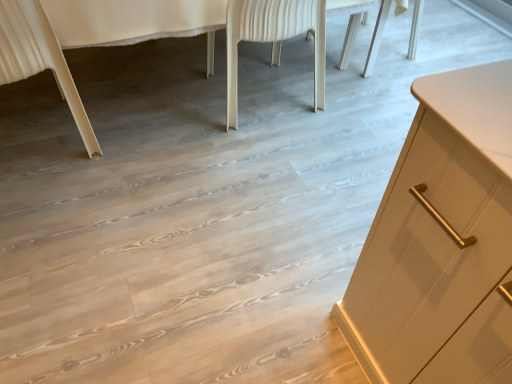
Find the location of a particular element. The image size is (512, 384). white wood chair at center, marked as the 1th chair in a right-to-left arrangement is located at coordinates (273, 39).

In order to face white glossy cabinet at right, should I rotate leftwards or rightwards?

To face it directly, rotate left by 8.576 degrees.

Where is `light beige wood chair leg at lower left, placed as the 1th chair when sorted from left to right`? light beige wood chair leg at lower left, placed as the 1th chair when sorted from left to right is located at coordinates (39, 58).

Measure the distance between white glossy cabinet at right and light beige wood chair leg at lower left, placed as the 1th chair when sorted from left to right.

A distance of 2.62 inches exists between white glossy cabinet at right and light beige wood chair leg at lower left, placed as the 1th chair when sorted from left to right.

Is white glossy cabinet at right positioned far away from light beige wood chair leg at lower left, placed as the 1th chair when sorted from left to right?

No.

Considering the relative sizes of white glossy cabinet at right and light beige wood chair leg at lower left, placed as the 1th chair when sorted from left to right, in the image provided, is white glossy cabinet at right smaller than light beige wood chair leg at lower left, placed as the 1th chair when sorted from left to right,?

Actually, white glossy cabinet at right might be larger than light beige wood chair leg at lower left, placed as the 1th chair when sorted from left to right.

Is white glossy cabinet at right positioned beyond the bounds of light beige wood chair leg at lower left, which is counted as the 2th chair, starting from the right?

white glossy cabinet at right lies outside light beige wood chair leg at lower left, which is counted as the 2th chair, starting from the right,'s area.

Can we say white wood chair at center, marked as the 1th chair in a right-to-left arrangement, lies outside light beige wood chair leg at lower left, placed as the 1th chair when sorted from left to right?

white wood chair at center, marked as the 1th chair in a right-to-left arrangement, is positioned outside light beige wood chair leg at lower left, placed as the 1th chair when sorted from left to right.

Does point (233, 84) appear closer or farther from the camera than point (26, 32)?

Point (233, 84) appears to be farther away from the viewer than point (26, 32).

Which object is wider, white wood chair at center, marked as the 1th chair in a right-to-left arrangement, or light beige wood chair leg at lower left, which is counted as the 2th chair, starting from the right?

white wood chair at center, marked as the 1th chair in a right-to-left arrangement.

From the image's perspective, does white wood chair at center, which appears as the second chair when viewed from the left, appear higher than light beige wood chair leg at lower left, which is counted as the 2th chair, starting from the right?

Yes, from the image's perspective, white wood chair at center, which appears as the second chair when viewed from the left, is over light beige wood chair leg at lower left, which is counted as the 2th chair, starting from the right.

Is white glossy cabinet at right facing towards white wood chair at center, marked as the 1th chair in a right-to-left arrangement?

Yes, white glossy cabinet at right is turned towards white wood chair at center, marked as the 1th chair in a right-to-left arrangement.

Is white glossy cabinet at right beside white wood chair at center, which appears as the second chair when viewed from the left?

No, white glossy cabinet at right is not with white wood chair at center, which appears as the second chair when viewed from the left.

Can you confirm if white glossy cabinet at right is bigger than white wood chair at center, which appears as the second chair when viewed from the left?

Correct, white glossy cabinet at right is larger in size than white wood chair at center, which appears as the second chair when viewed from the left.

Can you confirm if white glossy cabinet at right is thinner than white wood chair at center, which appears as the second chair when viewed from the left?

Incorrect, the width of white glossy cabinet at right is not less than that of white wood chair at center, which appears as the second chair when viewed from the left.

Is light beige wood chair leg at lower left, placed as the 1th chair when sorted from left to right, positioned far away from white glossy cabinet at right?

No, light beige wood chair leg at lower left, placed as the 1th chair when sorted from left to right, is not far from white glossy cabinet at right.

Looking at this image, from the image's perspective, between light beige wood chair leg at lower left, placed as the 1th chair when sorted from left to right, and white glossy cabinet at right, who is located below?

light beige wood chair leg at lower left, placed as the 1th chair when sorted from left to right.

Does light beige wood chair leg at lower left, which is counted as the 2th chair, starting from the right, have a lesser height compared to white glossy cabinet at right?

Correct, light beige wood chair leg at lower left, which is counted as the 2th chair, starting from the right, is not as tall as white glossy cabinet at right.

Can you tell me how much light beige wood chair leg at lower left, placed as the 1th chair when sorted from left to right, and white wood chair at center, marked as the 1th chair in a right-to-left arrangement, differ in facing direction?

They differ by 4.4 degrees in their facing directions.

Is light beige wood chair leg at lower left, placed as the 1th chair when sorted from left to right, surrounding white wood chair at center, which appears as the second chair when viewed from the left?

Actually, white wood chair at center, which appears as the second chair when viewed from the left, is outside light beige wood chair leg at lower left, placed as the 1th chair when sorted from left to right.

This screenshot has width=512, height=384. Find the location of `chair that appears in front of the white wood chair at center, marked as the 1th chair in a right-to-left arrangement`. chair that appears in front of the white wood chair at center, marked as the 1th chair in a right-to-left arrangement is located at coordinates (39, 58).

Considering the sizes of white wood chair at center, which appears as the second chair when viewed from the left, and white glossy cabinet at right in the image, is white wood chair at center, which appears as the second chair when viewed from the left, wider or thinner than white glossy cabinet at right?

white wood chair at center, which appears as the second chair when viewed from the left, is thinner than white glossy cabinet at right.

Is white wood chair at center, which appears as the second chair when viewed from the left, not near white glossy cabinet at right?

No, there isn't a large distance between white wood chair at center, which appears as the second chair when viewed from the left, and white glossy cabinet at right.

From the image's perspective, is white wood chair at center, which appears as the second chair when viewed from the left, below white glossy cabinet at right?

Indeed, from the image's perspective, white wood chair at center, which appears as the second chair when viewed from the left, is shown beneath white glossy cabinet at right.

How different are the orientations of white wood chair at center, marked as the 1th chair in a right-to-left arrangement, and white glossy cabinet at right in degrees?

They differ by 178 degrees in their facing directions.

Find the location of a particular element. The height and width of the screenshot is (384, 512). chair on the left of white glossy cabinet at right is located at coordinates (39, 58).

The width and height of the screenshot is (512, 384). I want to click on chair lying above the light beige wood chair leg at lower left, placed as the 1th chair when sorted from left to right (from the image's perspective), so click(273, 39).

Estimate the real-world distances between objects in this image. Which object is further from white wood chair at center, which appears as the second chair when viewed from the left, white glossy cabinet at right or light beige wood chair leg at lower left, which is counted as the 2th chair, starting from the right?

light beige wood chair leg at lower left, which is counted as the 2th chair, starting from the right, lies further to white wood chair at center, which appears as the second chair when viewed from the left, than the other object.

When comparing their distances from light beige wood chair leg at lower left, placed as the 1th chair when sorted from left to right, does white glossy cabinet at right or white wood chair at center, marked as the 1th chair in a right-to-left arrangement, seem further?

Based on the image, white wood chair at center, marked as the 1th chair in a right-to-left arrangement, appears to be further to light beige wood chair leg at lower left, placed as the 1th chair when sorted from left to right.

Which object lies nearer to the anchor point white glossy cabinet at right, light beige wood chair leg at lower left, which is counted as the 2th chair, starting from the right, or white wood chair at center, which appears as the second chair when viewed from the left?

light beige wood chair leg at lower left, which is counted as the 2th chair, starting from the right, lies closer to white glossy cabinet at right than the other object.

Estimate the real-world distances between objects in this image. Which object is closer to light beige wood chair leg at lower left, which is counted as the 2th chair, starting from the right, white wood chair at center, marked as the 1th chair in a right-to-left arrangement, or white glossy cabinet at right?

white glossy cabinet at right is positioned closer to the anchor light beige wood chair leg at lower left, which is counted as the 2th chair, starting from the right.

From the image, which object appears to be farther from white glossy cabinet at right, white wood chair at center, which appears as the second chair when viewed from the left, or light beige wood chair leg at lower left, which is counted as the 2th chair, starting from the right?

white wood chair at center, which appears as the second chair when viewed from the left, is further to white glossy cabinet at right.

From the image, which object appears to be farther from white wood chair at center, marked as the 1th chair in a right-to-left arrangement, light beige wood chair leg at lower left, placed as the 1th chair when sorted from left to right, or white glossy cabinet at right?

light beige wood chair leg at lower left, placed as the 1th chair when sorted from left to right, lies further to white wood chair at center, marked as the 1th chair in a right-to-left arrangement, than the other object.

Identify the location of vanity between light beige wood chair leg at lower left, which is counted as the 2th chair, starting from the right, and white wood chair at center, which appears as the second chair when viewed from the left, from left to right. (93, 37).